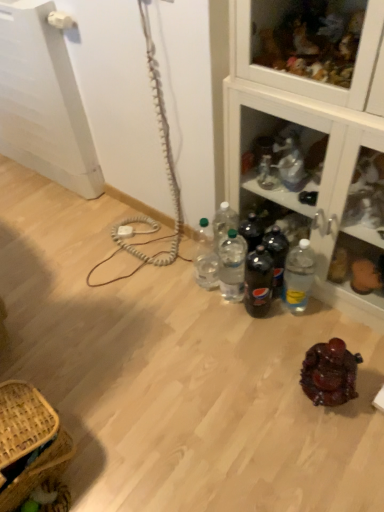
Question: In which direction should I rotate to look at dark glass bottle at center, the 3th bottle positioned from the right?

Choices:
 (A) left
 (B) right

Answer: (B)

Question: Is translucent plastic soda bottles at center, the fourth bottle from the left, positioned before clear glass cabinet at upper right?

Choices:
 (A) yes
 (B) no

Answer: (B)

Question: Considering the relative positions of translucent plastic soda bottles at center, the fourth bottle from the left, and clear glass cabinet at upper right in the image provided, is translucent plastic soda bottles at center, the fourth bottle from the left, to the left of clear glass cabinet at upper right from the viewer's perspective?

Choices:
 (A) yes
 (B) no

Answer: (A)

Question: From the image's perspective, is translucent plastic soda bottles at center, which is counted as the second bottle, starting from the right, under clear glass cabinet at upper right?

Choices:
 (A) no
 (B) yes

Answer: (B)

Question: Is translucent plastic soda bottles at center, the fourth bottle from the left, touching clear glass cabinet at upper right?

Choices:
 (A) no
 (B) yes

Answer: (A)

Question: Is translucent plastic soda bottles at center, the fourth bottle from the left, shorter than clear glass cabinet at upper right?

Choices:
 (A) no
 (B) yes

Answer: (B)

Question: Does translucent plastic soda bottles at center, which is counted as the second bottle, starting from the right, turn towards clear glass cabinet at upper right?

Choices:
 (A) no
 (B) yes

Answer: (A)

Question: Can you confirm if clear plastic bottles at center, positioned as the fourth bottle in right-to-left order, is thinner than clear plastic bottles at center, the fifth bottle positioned from the right?

Choices:
 (A) no
 (B) yes

Answer: (B)

Question: Would you say clear plastic bottles at center, marked as the second bottle in a left-to-right arrangement, is outside clear plastic bottles at center, the first bottle in the left-to-right sequence?

Choices:
 (A) yes
 (B) no

Answer: (A)

Question: From a real-world perspective, is clear plastic bottles at center, marked as the second bottle in a left-to-right arrangement, over clear plastic bottles at center, the first bottle in the left-to-right sequence?

Choices:
 (A) yes
 (B) no

Answer: (B)

Question: Is clear plastic bottles at center, positioned as the fourth bottle in right-to-left order, facing away from clear plastic bottles at center, the first bottle in the left-to-right sequence?

Choices:
 (A) yes
 (B) no

Answer: (B)

Question: Does clear plastic bottles at center, marked as the second bottle in a left-to-right arrangement, lie in front of clear plastic bottles at center, the first bottle in the left-to-right sequence?

Choices:
 (A) yes
 (B) no

Answer: (A)

Question: Is dark glass bottle at center, the 3th bottle positioned from the right, closer to camera compared to brown woven picnic basket at lower left?

Choices:
 (A) no
 (B) yes

Answer: (A)